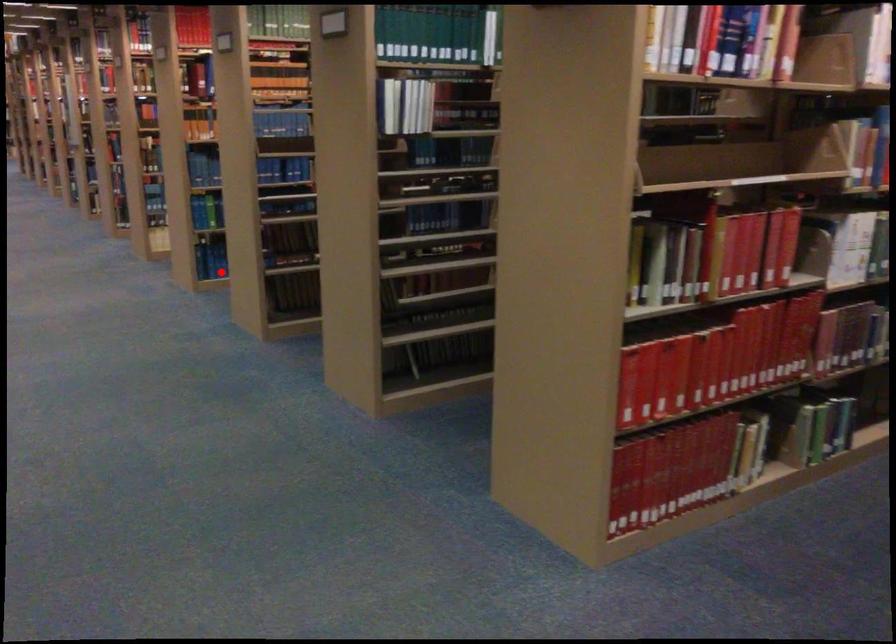
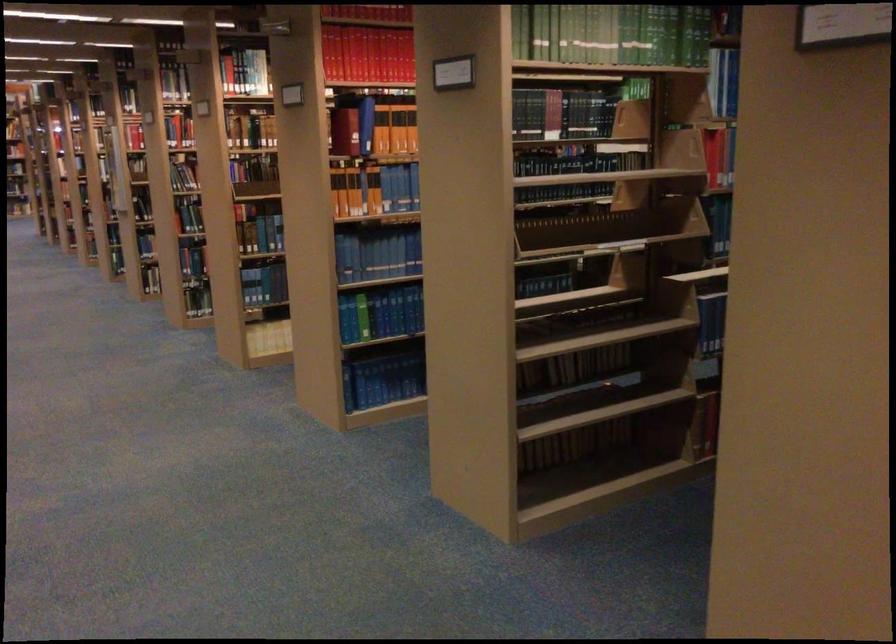
Find the pixel in the second image that matches the highlighted location in the first image.

(383, 380)